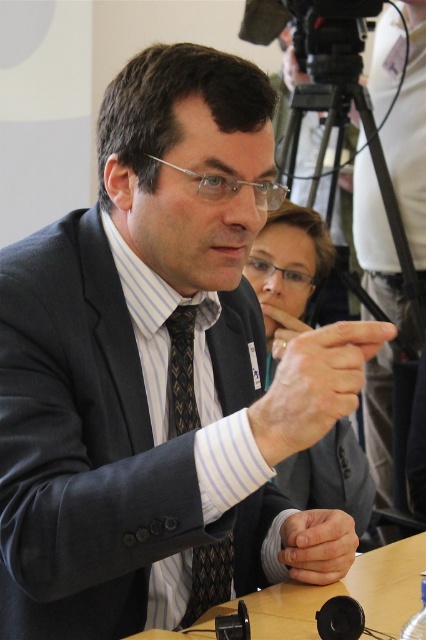
Question: Can you confirm if matte black suit at center is thinner than white matte hand at center?

Choices:
 (A) no
 (B) yes

Answer: (A)

Question: Is matte black suit at center positioned before black textured tie at center?

Choices:
 (A) yes
 (B) no

Answer: (B)

Question: Which is farther from the smooth skin hands at center?

Choices:
 (A) white matte hand at center
 (B) matte black suit at center
 (C) dark gray suit at center
 (D) black textured tie at center

Answer: (B)

Question: Which point is closer to the camera taking this photo?

Choices:
 (A) (296, 449)
 (B) (192, 426)

Answer: (A)

Question: Is dark gray suit at center wider than black textured tie at center?

Choices:
 (A) no
 (B) yes

Answer: (B)

Question: Estimate the real-world distances between objects in this image. Which object is farther from the black textured tie at center?

Choices:
 (A) white matte hand at center
 (B) matte black suit at center

Answer: (B)